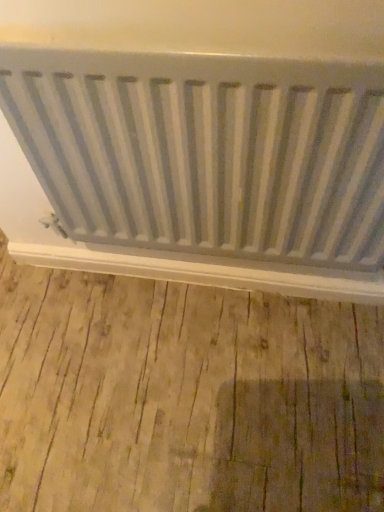
This screenshot has width=384, height=512. What are the coordinates of `vacant space underneath white matte radiator at lower center (from a real-world perspective)` in the screenshot? It's located at (190, 284).